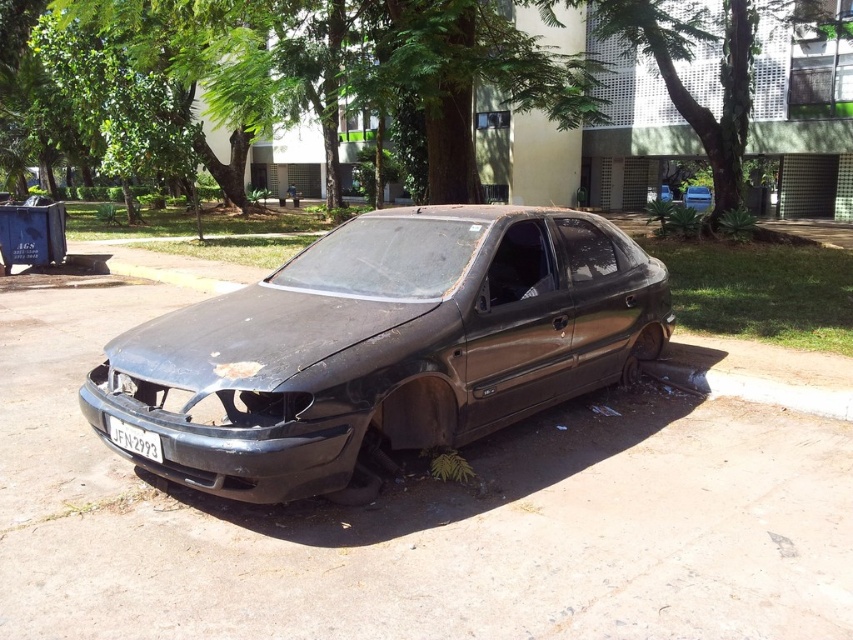
You are a delivery person trying to park your van between the dull metallic car at center and the green leafy tree at center. Can you fit your van, which is 2 meters tall, between them without hitting the top?

The dull metallic car at center is shorter than the green leafy tree at center. Since the van is 2 meters tall, it depends on the minimum height between them. However, since the car is shorter, the lowest point might be near the car. Without exact height measurements, we can infer that the tree is taller, so the space between them might have enough vertical clearance for the van if the lowest point is above 2 meters. But the description only states the car is shorter than the tree, not the actual heights. A

You are a delivery driver who needs to park your vehicle in this area. There is a dull metallic car at center blocking the parking spot. Can you park your car here?

The dull metallic car at center is located at point (383,346), so yes, you can park your car here as long as you position it appropriately around the existing vehicle.

You are standing in front of the damaged black car and want to place a small flag at point (292, 294) and another flag at point (21, 38). Which flag will be closer to you?

The flag placed at point (292, 294) will be closer to you because the point is closer to the viewer than point (21, 38).